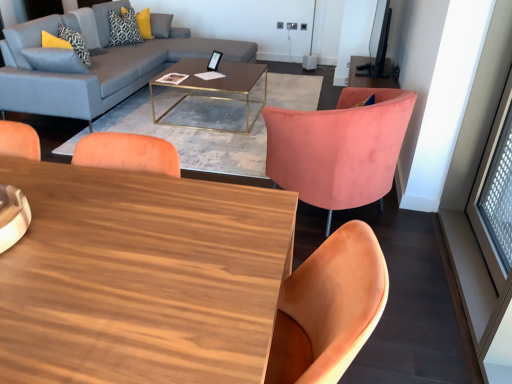
What do you see at coordinates (94, 67) in the screenshot? I see `matte gray fabric couch at upper left` at bounding box center [94, 67].

Looking at this image, how much space does patterned fabric pillow at upper left, acting as the first pillow starting from the front, occupy horizontally?

patterned fabric pillow at upper left, acting as the first pillow starting from the front, is 11.08 inches in width.

I want to click on metallic gold coffee table at center, which appears as the 2th coffee table when viewed from the front, so click(214, 83).

Where is `wooden coffee table at center, which is counted as the second coffee table, starting from the back`? This screenshot has height=384, width=512. wooden coffee table at center, which is counted as the second coffee table, starting from the back is located at coordinates (141, 277).

The image size is (512, 384). Describe the element at coordinates (124, 28) in the screenshot. I see `yellow textured pillow at upper left, marked as the 1th pillow in a top-to-bottom arrangement` at that location.

I want to click on matte gray fabric couch at upper left, so click(x=94, y=67).

Considering the positions of point (254, 70) and point (136, 32), is point (254, 70) closer or farther from the camera than point (136, 32)?

Point (254, 70) is closer to the camera than point (136, 32).

Between metallic gold coffee table at center, the 2th coffee table ordered from the bottom, and yellow textured pillow at upper left, the second pillow viewed from the front, which one has larger size?

metallic gold coffee table at center, the 2th coffee table ordered from the bottom.

From a real-world perspective, who is located lower, metallic gold coffee table at center, the first coffee table positioned from the back, or yellow textured pillow at upper left, positioned as the 1th pillow in back-to-front order?

metallic gold coffee table at center, the first coffee table positioned from the back, from a real-world perspective.

Does metallic gold coffee table at center, which appears as the 2th coffee table when viewed from the front, appear on the left side of yellow textured pillow at upper left, which is the second pillow from bottom to top?

No, metallic gold coffee table at center, which appears as the 2th coffee table when viewed from the front, is not to the left of yellow textured pillow at upper left, which is the second pillow from bottom to top.

Looking at this image, considering their positions, is velvet pink chair at center located in front of or behind patterned fabric pillow at upper left, which is counted as the 2th pillow, starting from the top?

velvet pink chair at center is in front of patterned fabric pillow at upper left, which is counted as the 2th pillow, starting from the top.

Locate an element on the screen. chair located in front of the patterned fabric pillow at upper left, the 1th pillow ordered from the bottom is located at coordinates (339, 148).

Between velvet pink chair at center and patterned fabric pillow at upper left, the 1th pillow ordered from the bottom, which one has larger size?

→ velvet pink chair at center.

Is patterned fabric pillow at upper left, acting as the first pillow starting from the front, inside velvet pink chair at center?

No, patterned fabric pillow at upper left, acting as the first pillow starting from the front, is not a part of velvet pink chair at center.

Between point (154, 326) and point (345, 128), which one is positioned behind?

Positioned behind is point (345, 128).

Are wooden coffee table at center, the first coffee table ordered from the bottom, and velvet pink chair at center making contact?

wooden coffee table at center, the first coffee table ordered from the bottom, is not next to velvet pink chair at center, and they're not touching.

Is wooden coffee table at center, the first coffee table positioned from the front, positioned in front of velvet pink chair at center?

Yes, wooden coffee table at center, the first coffee table positioned from the front, is closer to the viewer.

Does metallic gold coffee table at center, positioned as the 1th coffee table in top-to-bottom order, have a greater height compared to velvet pink chair at center?

No, metallic gold coffee table at center, positioned as the 1th coffee table in top-to-bottom order, is not taller than velvet pink chair at center.

From a real-world perspective, which object stands above the other?

velvet pink chair at center, from a real-world perspective.

From the image's perspective, relative to velvet pink chair at center, is metallic gold coffee table at center, positioned as the 1th coffee table in top-to-bottom order, above or below?

Clearly, from the image's perspective, metallic gold coffee table at center, positioned as the 1th coffee table in top-to-bottom order, is above velvet pink chair at center.

From the image's perspective, relative to patterned fabric pillow at upper left, the 2th pillow positioned from the back, is matte gray fabric couch at upper left above or below?

Based on their image positions, matte gray fabric couch at upper left is located beneath patterned fabric pillow at upper left, the 2th pillow positioned from the back.

Is matte gray fabric couch at upper left touching patterned fabric pillow at upper left, the 1th pillow ordered from the bottom?

They are not placed beside each other.

Considering the relative positions of matte gray fabric couch at upper left and patterned fabric pillow at upper left, which is counted as the 2th pillow, starting from the top, in the image provided, is matte gray fabric couch at upper left to the left of patterned fabric pillow at upper left, which is counted as the 2th pillow, starting from the top, from the viewer's perspective?

In fact, matte gray fabric couch at upper left is to the right of patterned fabric pillow at upper left, which is counted as the 2th pillow, starting from the top.

The height and width of the screenshot is (384, 512). Find the location of `studio couch that appears below the patterned fabric pillow at upper left, acting as the first pillow starting from the front (from a real-world perspective)`. studio couch that appears below the patterned fabric pillow at upper left, acting as the first pillow starting from the front (from a real-world perspective) is located at coordinates (94, 67).

Are yellow textured pillow at upper left, the second pillow viewed from the front, and metallic gold coffee table at center, the 2th coffee table ordered from the bottom, making contact?

No, yellow textured pillow at upper left, the second pillow viewed from the front, is not in contact with metallic gold coffee table at center, the 2th coffee table ordered from the bottom.

From a real-world perspective, is yellow textured pillow at upper left, marked as the 1th pillow in a top-to-bottom arrangement, above or below metallic gold coffee table at center, the 2th coffee table ordered from the bottom?

Clearly, from a real-world perspective, yellow textured pillow at upper left, marked as the 1th pillow in a top-to-bottom arrangement, is above metallic gold coffee table at center, the 2th coffee table ordered from the bottom.

From the image's perspective, is yellow textured pillow at upper left, marked as the 1th pillow in a top-to-bottom arrangement, positioned above or below metallic gold coffee table at center, the 2th coffee table ordered from the bottom?

Clearly, from the image's perspective, yellow textured pillow at upper left, marked as the 1th pillow in a top-to-bottom arrangement, is above metallic gold coffee table at center, the 2th coffee table ordered from the bottom.

Is metallic gold coffee table at center, the first coffee table positioned from the back, taller than matte gray fabric couch at upper left?

Incorrect, the height of metallic gold coffee table at center, the first coffee table positioned from the back, is not larger of that of matte gray fabric couch at upper left.

Considering the points (265, 102) and (65, 58), which point is behind, point (265, 102) or point (65, 58)?

The point (265, 102) is more distant.

Considering the sizes of objects metallic gold coffee table at center, the first coffee table positioned from the back, and matte gray fabric couch at upper left in the image provided, who is wider, metallic gold coffee table at center, the first coffee table positioned from the back, or matte gray fabric couch at upper left?

With larger width is matte gray fabric couch at upper left.

From the image's perspective, which pillow is the 2nd one above the metallic gold coffee table at center, which appears as the 2th coffee table when viewed from the front? Please provide its 2D coordinates.

[(124, 28)]

The width and height of the screenshot is (512, 384). Identify the location of the 1st pillow behind the velvet pink chair at center. (75, 43).

Consider the image. Estimate the real-world distances between objects in this image. Which object is closer to yellow textured pillow at upper left, marked as the 1th pillow in a top-to-bottom arrangement, matte gray fabric couch at upper left or metallic gold coffee table at center, the first coffee table positioned from the back?

matte gray fabric couch at upper left.

Considering their positions, is yellow textured pillow at upper left, marked as the 1th pillow in a top-to-bottom arrangement, positioned closer to matte gray fabric couch at upper left than wooden coffee table at center, the 2th coffee table from the top?

yellow textured pillow at upper left, marked as the 1th pillow in a top-to-bottom arrangement, lies closer to matte gray fabric couch at upper left than the other object.

Looking at this image, based on their spatial positions, is metallic gold coffee table at center, the 2th coffee table ordered from the bottom, or yellow textured pillow at upper left, positioned as the 1th pillow in back-to-front order, further from wooden coffee table at center, the 2th coffee table from the top?

yellow textured pillow at upper left, positioned as the 1th pillow in back-to-front order, is further to wooden coffee table at center, the 2th coffee table from the top.

Looking at the image, which one is located further to patterned fabric pillow at upper left, which is counted as the 2th pillow, starting from the top, yellow textured pillow at upper left, marked as the 1th pillow in a top-to-bottom arrangement, or wooden coffee table at center, the first coffee table ordered from the bottom?

wooden coffee table at center, the first coffee table ordered from the bottom, is further to patterned fabric pillow at upper left, which is counted as the 2th pillow, starting from the top.

Estimate the real-world distances between objects in this image. Which object is further from wooden coffee table at center, which is counted as the second coffee table, starting from the back, velvet pink chair at center or yellow textured pillow at upper left, positioned as the 1th pillow in back-to-front order?

yellow textured pillow at upper left, positioned as the 1th pillow in back-to-front order, lies further to wooden coffee table at center, which is counted as the second coffee table, starting from the back, than the other object.

Looking at the image, which one is located closer to patterned fabric pillow at upper left, which is counted as the 2th pillow, starting from the top, velvet pink chair at center or yellow textured pillow at upper left, marked as the 1th pillow in a top-to-bottom arrangement?

Among the two, yellow textured pillow at upper left, marked as the 1th pillow in a top-to-bottom arrangement, is located nearer to patterned fabric pillow at upper left, which is counted as the 2th pillow, starting from the top.

Which object lies further to the anchor point velvet pink chair at center, patterned fabric pillow at upper left, the 1th pillow ordered from the bottom, or yellow textured pillow at upper left, which is the second pillow from bottom to top?

yellow textured pillow at upper left, which is the second pillow from bottom to top, is further to velvet pink chair at center.

Which object lies further to the anchor point patterned fabric pillow at upper left, the 2th pillow positioned from the back, matte gray fabric couch at upper left or wooden coffee table at center, which is counted as the second coffee table, starting from the back?

Based on the image, wooden coffee table at center, which is counted as the second coffee table, starting from the back, appears to be further to patterned fabric pillow at upper left, the 2th pillow positioned from the back.

This screenshot has height=384, width=512. I want to click on studio couch between wooden coffee table at center, the first coffee table positioned from the front, and metallic gold coffee table at center, which appears as the 2th coffee table when viewed from the front, from front to back, so click(x=94, y=67).

I want to click on pillow between velvet pink chair at center and yellow textured pillow at upper left, the second pillow viewed from the front, from front to back, so click(x=75, y=43).

At what (x,y) coordinates should I click in order to perform the action: click on chair between wooden coffee table at center, the first coffee table positioned from the front, and yellow textured pillow at upper left, positioned as the 1th pillow in back-to-front order, in the front-back direction. Please return your answer as a coordinate pair (x, y). Looking at the image, I should click on (339, 148).

What are the coordinates of `studio couch located between wooden coffee table at center, the 2th coffee table from the top, and patterned fabric pillow at upper left, which is counted as the 2th pillow, starting from the top, in the depth direction` in the screenshot? It's located at (94, 67).